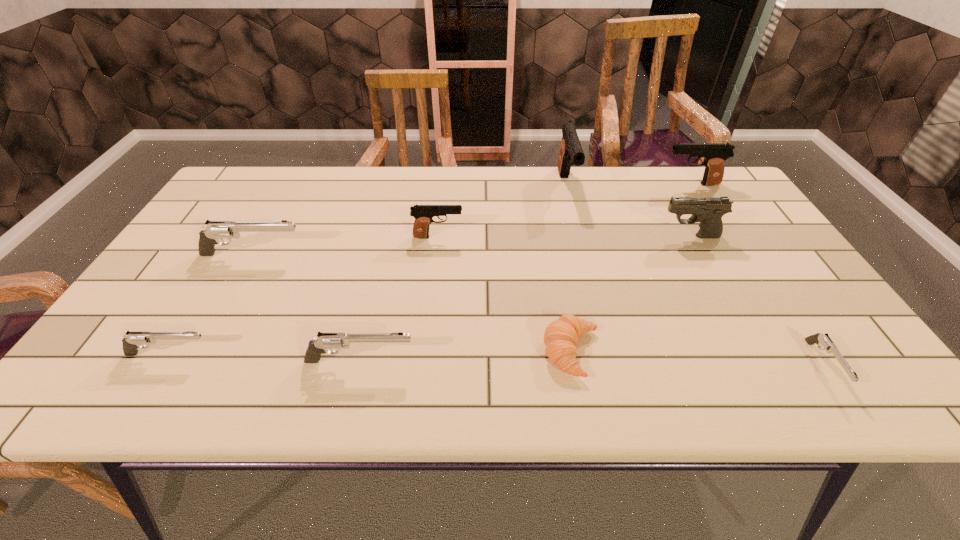
Find the location of a particular element. The height and width of the screenshot is (540, 960). object that stands as the third closest to the leftmost black pistol is located at coordinates (561, 336).

Identify which object is the fourth nearest to the second black pistol from left to right. Please provide its 2D coordinates. Your answer should be formatted as a tuple, i.e. [(x, y)], where the tuple contains the x and y coordinates of a point satisfying the conditions above.

[(561, 336)]

This screenshot has width=960, height=540. Identify the location of pistol that is the eighth closest to the crescent roll. (132, 341).

Image resolution: width=960 pixels, height=540 pixels. I want to click on pistol that is the second nearest to the sixth tallest pistol, so click(x=215, y=230).

You are a GUI agent. You are given a task and a screenshot of the screen. Output one action in this format:
    pyautogui.click(x=<x>, y=<y>)
    Task: Click on the black pistol that stands as the third closest to the fifth farthest pistol
    
    Given the screenshot: What is the action you would take?
    pyautogui.click(x=708, y=211)

Where is `black pistol that can be found as the fourth closest to the crescent roll`? Image resolution: width=960 pixels, height=540 pixels. black pistol that can be found as the fourth closest to the crescent roll is located at coordinates (715, 154).

This screenshot has width=960, height=540. In order to click on silver pistol that is the nearest to the second shortest pistol in this screenshot , I will do pyautogui.click(x=325, y=341).

Find the location of a particular element. The width and height of the screenshot is (960, 540). silver pistol that is the third closest to the leftmost black pistol is located at coordinates (132, 341).

The width and height of the screenshot is (960, 540). Identify the location of free space that satisfies the following two spatial constraints: 1. on the front-facing side of the farthest silver pistol; 2. on the right side of the crescent roll. (199, 352).

I want to click on free spot that satisfies the following two spatial constraints: 1. at the barrel of the fourth pistol from right to left; 2. at the barrel of the smallest black pistol, so click(x=580, y=237).